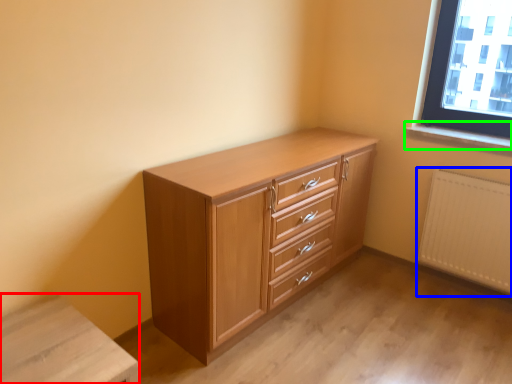
Question: Based on their relative distances, which object is nearer to changing table (highlighted by a red box)? Choose from radiator (highlighted by a blue box) and window sill (highlighted by a green box).

Choices:
 (A) radiator
 (B) window sill

Answer: (A)